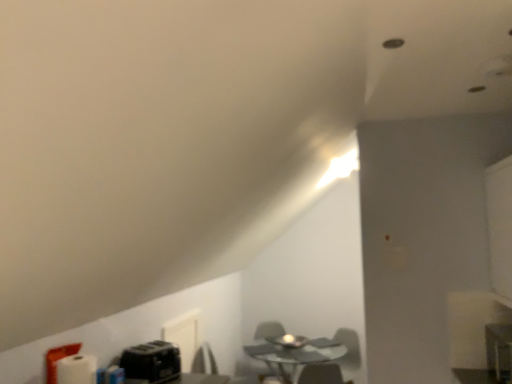
Question: Based on their sizes in the image, would you say transparent glass table at center is bigger or smaller than black plastic toaster at lower left?

Choices:
 (A) big
 (B) small

Answer: (A)

Question: Is transparent glass table at center taller or shorter than black plastic toaster at lower left?

Choices:
 (A) tall
 (B) short

Answer: (A)

Question: Which object is the closest to the black plastic toaster at lower left?

Choices:
 (A) matte gray swivel chair at center
 (B) transparent glass table at center
 (C) metallic silver computer desk at lower right

Answer: (B)

Question: Which is nearer to the black plastic toaster at lower left?

Choices:
 (A) transparent glass table at center
 (B) metallic silver computer desk at lower right
 (C) matte gray swivel chair at center

Answer: (A)